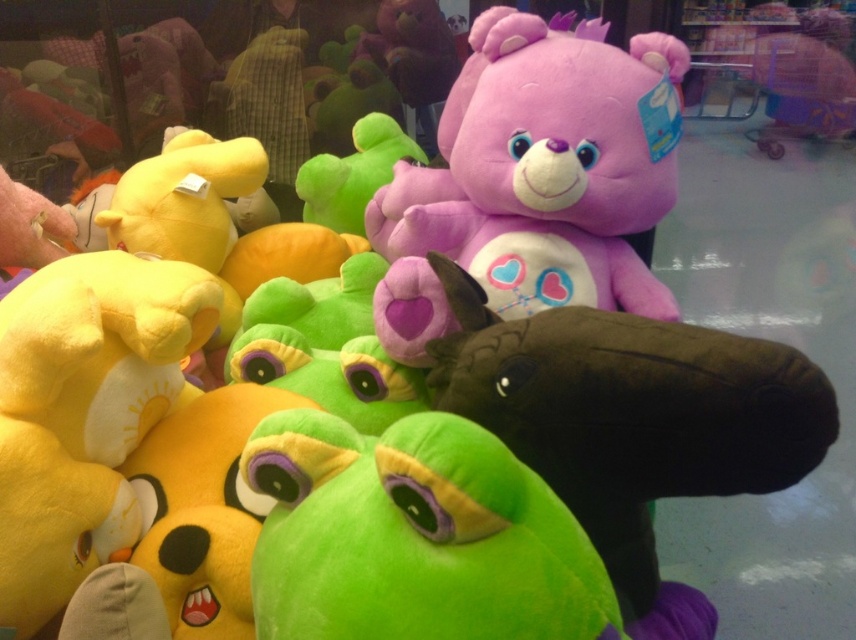
You are a customer in a toy store and see the purple plush bear at upper center. If you want to find its exact location on a grid where the bottom left corner is 0,0 and the top right corner is 1,1, what are its coordinates?

The purple plush bear at upper center is located at coordinates (535, 179).

You are a customer in a toy store looking at the purple plush bear at upper center and the green plush toy at center. Which one do you think is bigger?

The purple plush bear at upper center is larger in size than the green plush toy at center, so the purple plush bear at upper center is bigger.